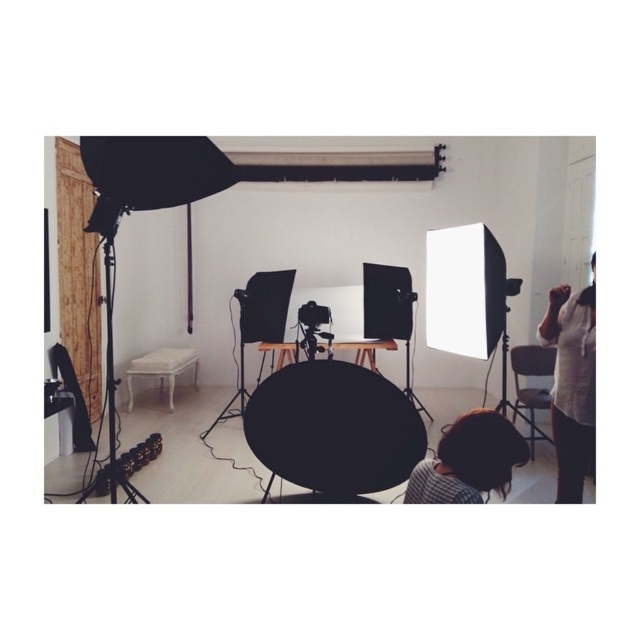
You are a photographer setting up a studio shoot. You have a 10 feet long extension cord that needs to be connected to the brown hair at lower center and the black matte tripod at center. Will the cord be long enough to reach both devices without needing to move them?

The brown hair at lower center and black matte tripod at center are 9.71 feet apart from each other. Since the extension cord is 10 feet long, it will be long enough to reach both devices without needing to move them.